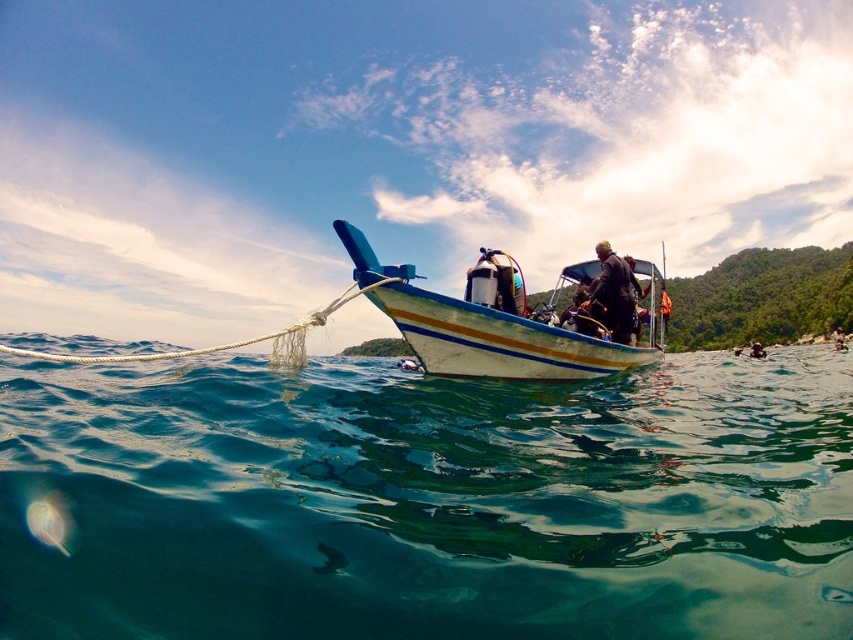
You are a photographer trying to capture a clear shot of the wooden boat at center and the dark brown leather jacket at center. Since you want to focus on the boat, which object should you adjust your camera lens to prioritize in terms of size in the frame?

The wooden boat at center is taller than the dark brown leather jacket at center, so you should adjust your camera lens to prioritize the wooden boat at center as it already appears larger in the frame.

What are the coordinates of the dark brown leather jacket at center?

The dark brown leather jacket at center is located at point (613, 294).

You are a photographer positioned on the shore, aiming to capture a clear image of both the wooden boat at center and the dark brown leather jacket at center. Since both are in your viewfinder, which object should you focus on first to ensure sharpness?

The wooden boat at center is closer to the viewer than the dark brown leather jacket at center, so you should focus on the wooden boat at center first to ensure it is in sharp focus before adjusting for the jacket.